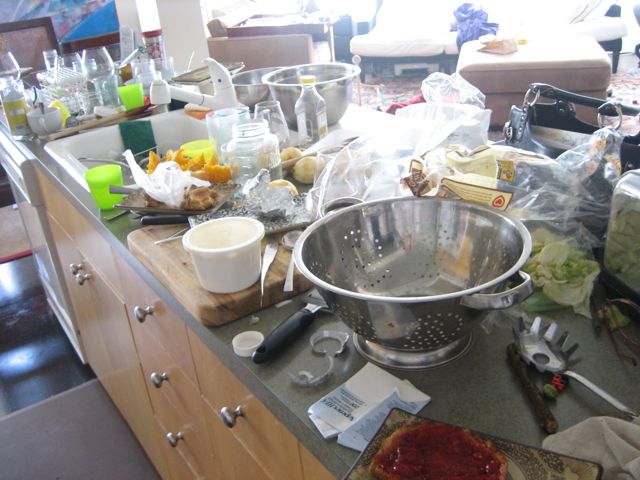
You are a GUI agent. You are given a task and a screenshot of the screen. Output one action in this format:
    pyautogui.click(x=<x>, y=<y>)
    Task: Click on the cabinet hardward
    The image size is (640, 480).
    Given the screenshot: What is the action you would take?
    73,265, 80,276, 140,314, 153,379, 227,418, 172,437, 172,416